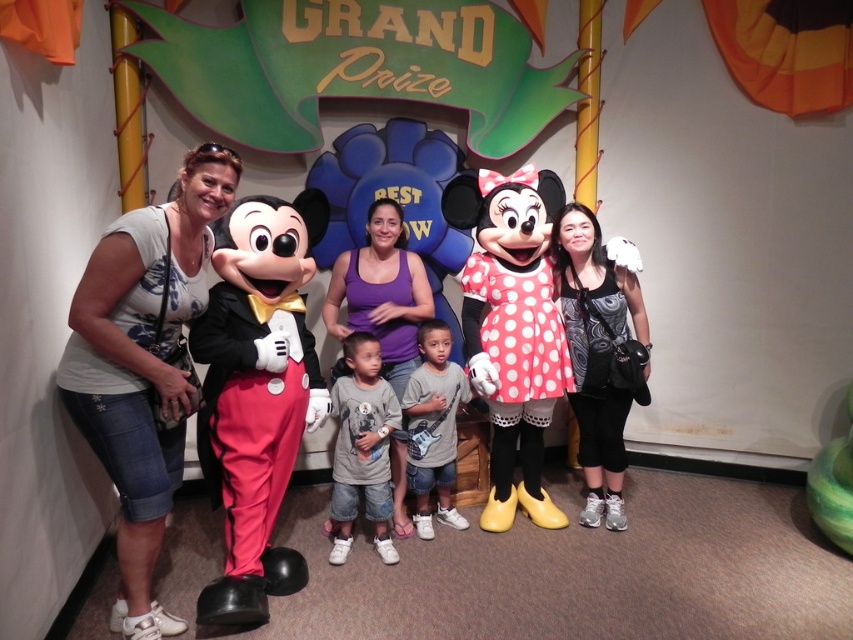
Question: Which of the following is the closest to the observer?

Choices:
 (A) purple fabric tank top at center
 (B) gray cotton shirt at center

Answer: (B)

Question: Which point appears closest to the camera in this image?

Choices:
 (A) (386, 484)
 (B) (426, 358)
 (C) (138, 561)

Answer: (C)

Question: From the image, what is the correct spatial relationship of white printed t-shirt at left in relation to gray cotton shirt at center?

Choices:
 (A) above
 (B) below

Answer: (A)

Question: Which object is positioned farthest from the purple fabric tank top at center?

Choices:
 (A) black textured top at right
 (B) gray matte guitar at center
 (C) white printed t-shirt at left
 (D) matte black tuxedo at center

Answer: (C)

Question: Is matte black tuxedo at center to the left of black textured top at right from the viewer's perspective?

Choices:
 (A) no
 (B) yes

Answer: (B)

Question: Is gray cotton shirt at center to the left of gray matte guitar at center from the viewer's perspective?

Choices:
 (A) no
 (B) yes

Answer: (B)